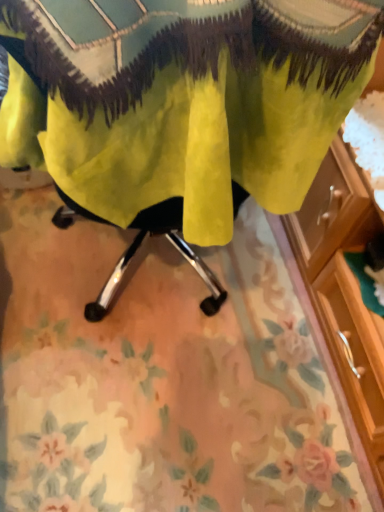
Locate an element on the screen. The image size is (384, 512). yellow fabric at center is located at coordinates (182, 100).

This screenshot has width=384, height=512. What do you see at coordinates (182, 100) in the screenshot?
I see `yellow fabric at center` at bounding box center [182, 100].

This screenshot has height=512, width=384. In order to click on yellow fabric at center in this screenshot , I will do `click(182, 100)`.